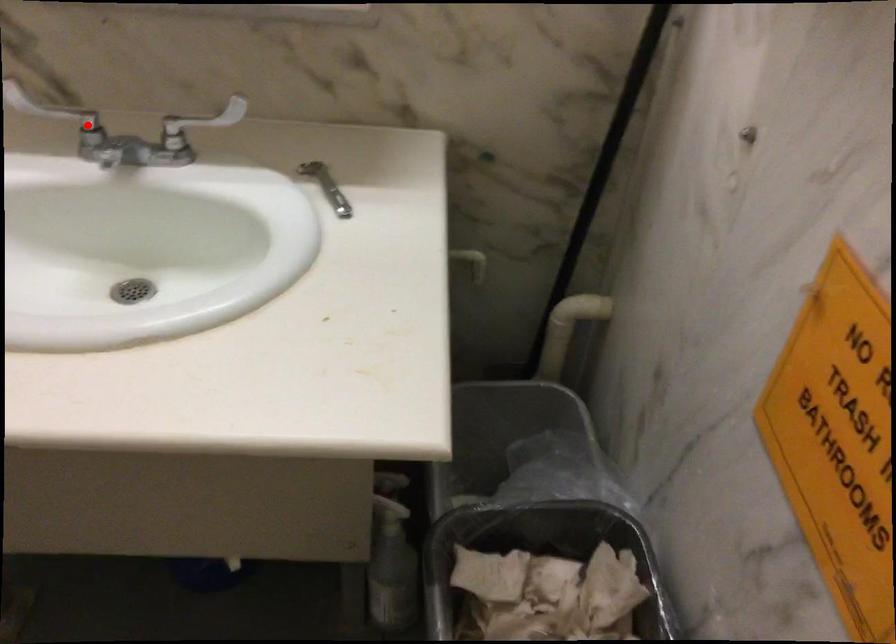
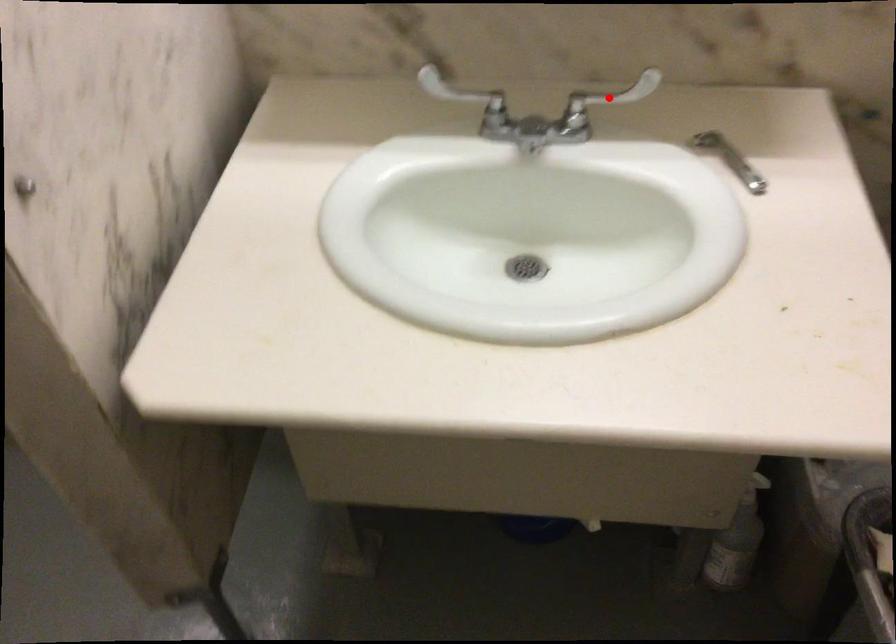
I am providing you with two images of the same scene from different viewpoints. A red point is marked on the first image and another point is marked on the second image. Does the point marked in image1 correspond to the same location as the one in image2?

No